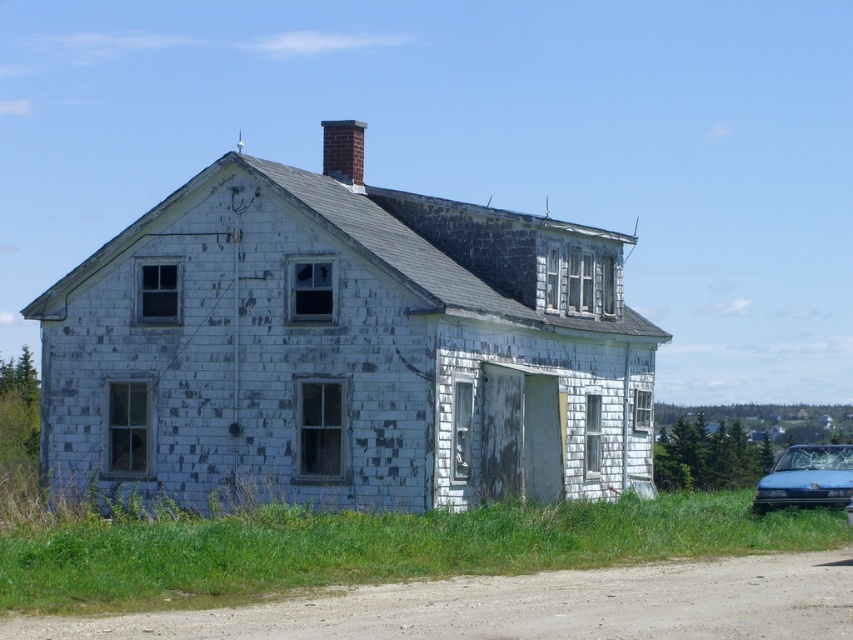
Question: Which object appears farthest from the camera in this image?

Choices:
 (A) dusty gravel road at lower center
 (B) blue matte car at lower right

Answer: (B)

Question: Does dusty gravel road at lower center appear on the left side of blue matte car at lower right?

Choices:
 (A) no
 (B) yes

Answer: (B)

Question: Does dusty gravel road at lower center come in front of blue matte car at lower right?

Choices:
 (A) no
 (B) yes

Answer: (B)

Question: Can you confirm if dusty gravel road at lower center is smaller than blue matte car at lower right?

Choices:
 (A) no
 (B) yes

Answer: (B)

Question: Which point is closer to the camera taking this photo?

Choices:
 (A) (354, 636)
 (B) (827, 483)

Answer: (A)

Question: Among these points, which one is farthest from the camera?

Choices:
 (A) (679, 628)
 (B) (809, 477)

Answer: (B)